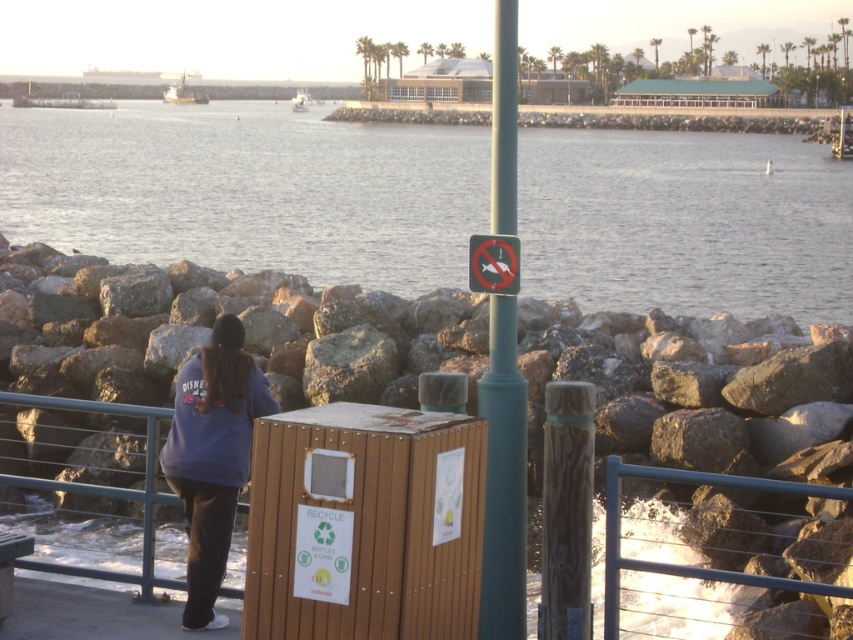
Between smooth water at center and wooden trash bin at center, which one appears on the right side from the viewer's perspective?

From the viewer's perspective, smooth water at center appears more on the right side.

The image size is (853, 640). Describe the element at coordinates (248, 189) in the screenshot. I see `smooth water at center` at that location.

What are the coordinates of `smooth water at center` in the screenshot? It's located at (248, 189).

Does wooden trash bin at center appear on the right side of blue metal rail at lower right?

No, wooden trash bin at center is not to the right of blue metal rail at lower right.

Can you confirm if wooden trash bin at center is positioned below blue metal rail at lower right?

Incorrect, wooden trash bin at center is not positioned below blue metal rail at lower right.

Between point (363, 404) and point (653, 570), which one is positioned behind?

The point (653, 570) is behind.

Identify the location of wooden trash bin at center. (364, 524).

Is smooth water at center positioned at the back of purple fleece jacket at lower left?

No, it is not.

Is smooth water at center thinner than purple fleece jacket at lower left?

Incorrect, smooth water at center's width is not less than purple fleece jacket at lower left's.

I want to click on smooth water at center, so click(x=248, y=189).

This screenshot has height=640, width=853. What are the coordinates of `smooth water at center` in the screenshot? It's located at (248, 189).